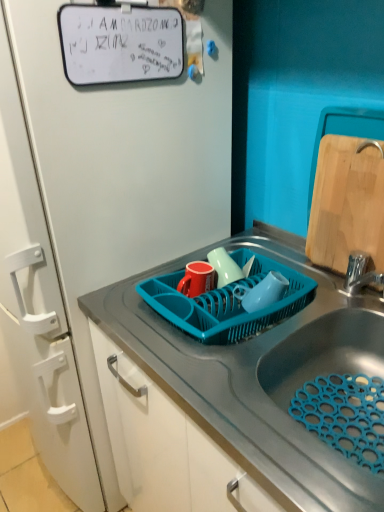
Image resolution: width=384 pixels, height=512 pixels. I want to click on vacant region to the left of wooden cutting board at right, so click(x=287, y=273).